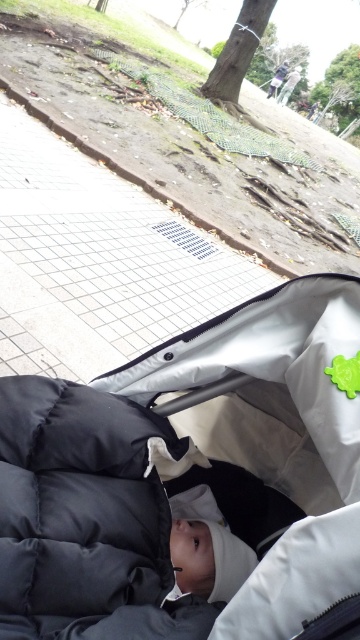
Does black puffy sleeping bag at center appear on the right side of white tile pavement at center?

Correct, you'll find black puffy sleeping bag at center to the right of white tile pavement at center.

Is point (88, 442) positioned behind point (33, 211)?

No, (88, 442) is closer to viewer.

Measure the distance between point (88,422) and camera.

Point (88,422) and camera are 3.61 feet apart.

Locate an element on the screen. This screenshot has width=360, height=640. black puffy sleeping bag at center is located at coordinates (86, 513).

Between dark gray quilted fabric baby carriage at center and black puffy sleeping bag at center, which one has more height?

dark gray quilted fabric baby carriage at center is taller.

Who is lower down, dark gray quilted fabric baby carriage at center or black puffy sleeping bag at center?

black puffy sleeping bag at center is lower down.

Who is more forward, (3, 598) or (25, 548)?

Point (3, 598)

Identify the location of dark gray quilted fabric baby carriage at center. (187, 483).

Is dark gray quilted fabric baby carriage at center bigger than white tile pavement at center?

Incorrect, dark gray quilted fabric baby carriage at center is not larger than white tile pavement at center.

Who is more forward, (336, 486) or (93, 180)?

Point (336, 486)

Who is more distant from viewer, [212,561] or [2,252]?

Point [2,252]

I want to click on dark gray quilted fabric baby carriage at center, so click(x=187, y=483).